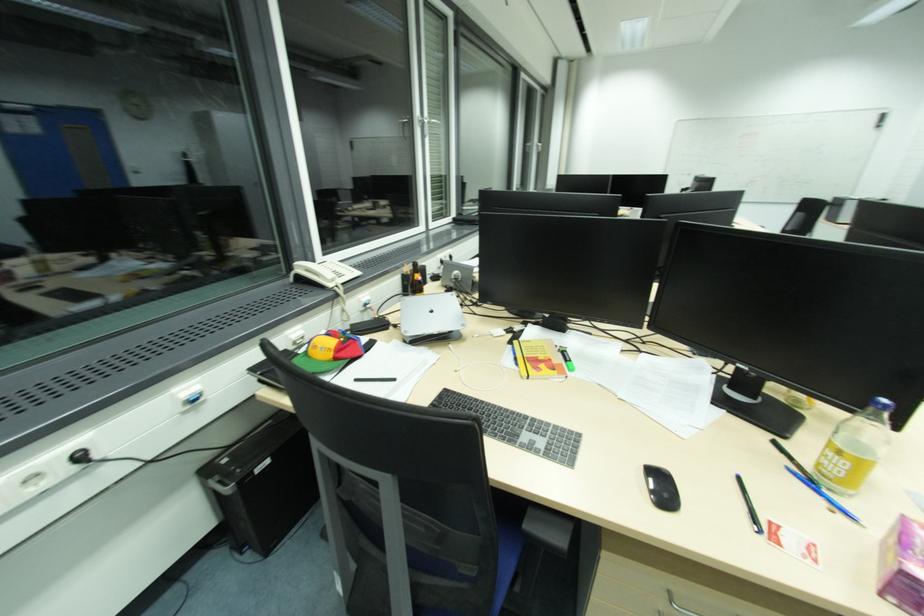
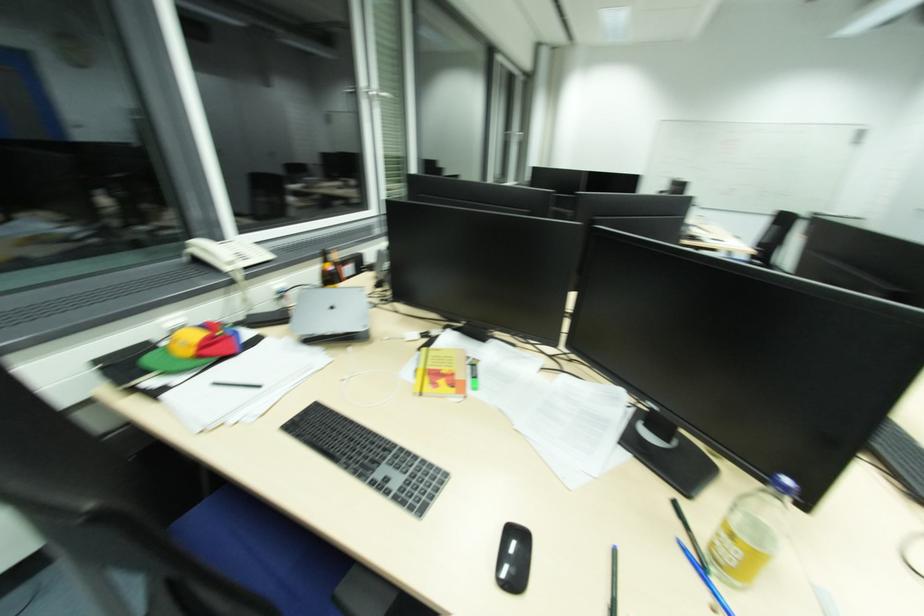
Question: How did the camera likely rotate?

Choices:
 (A) Left
 (B) Right
 (C) Up
 (D) Down

Answer: (B)